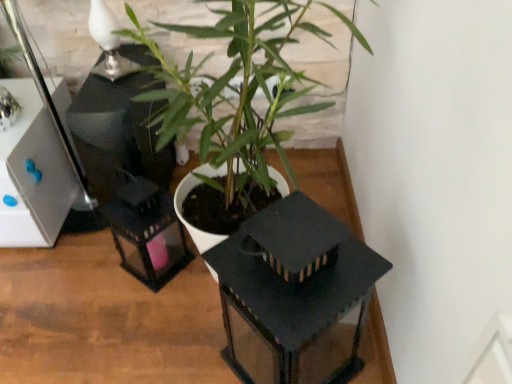
Question: From the image's perspective, does green matte plant at center appear lower than white glossy table lamp at upper left?

Choices:
 (A) no
 (B) yes

Answer: (B)

Question: From a real-world perspective, is green matte plant at center physically below white glossy table lamp at upper left?

Choices:
 (A) yes
 (B) no

Answer: (A)

Question: Is green matte plant at center closer to the viewer compared to white glossy table lamp at upper left?

Choices:
 (A) yes
 (B) no

Answer: (A)

Question: Is the surface of green matte plant at center in direct contact with white glossy table lamp at upper left?

Choices:
 (A) no
 (B) yes

Answer: (A)

Question: From a real-world perspective, is green matte plant at center on white glossy table lamp at upper left?

Choices:
 (A) yes
 (B) no

Answer: (B)

Question: Is green matte plant at center aimed at white glossy table lamp at upper left?

Choices:
 (A) yes
 (B) no

Answer: (B)

Question: From a real-world perspective, does white glossy table lamp at upper left sit lower than matte black lantern at center?

Choices:
 (A) yes
 (B) no

Answer: (B)

Question: Does white glossy table lamp at upper left have a larger size compared to matte black lantern at center?

Choices:
 (A) no
 (B) yes

Answer: (A)

Question: Does white glossy table lamp at upper left turn towards matte black lantern at center?

Choices:
 (A) yes
 (B) no

Answer: (B)

Question: Can matte black lantern at center be found inside white glossy table lamp at upper left?

Choices:
 (A) yes
 (B) no

Answer: (B)

Question: Is white glossy table lamp at upper left taller than matte black lantern at center?

Choices:
 (A) yes
 (B) no

Answer: (A)

Question: Considering the relative sizes of white glossy table lamp at upper left and matte black lantern at center in the image provided, is white glossy table lamp at upper left shorter than matte black lantern at center?

Choices:
 (A) yes
 (B) no

Answer: (B)

Question: Considering the relative sizes of matte black lantern at center and white glossy table lamp at upper left in the image provided, is matte black lantern at center smaller than white glossy table lamp at upper left?

Choices:
 (A) no
 (B) yes

Answer: (A)